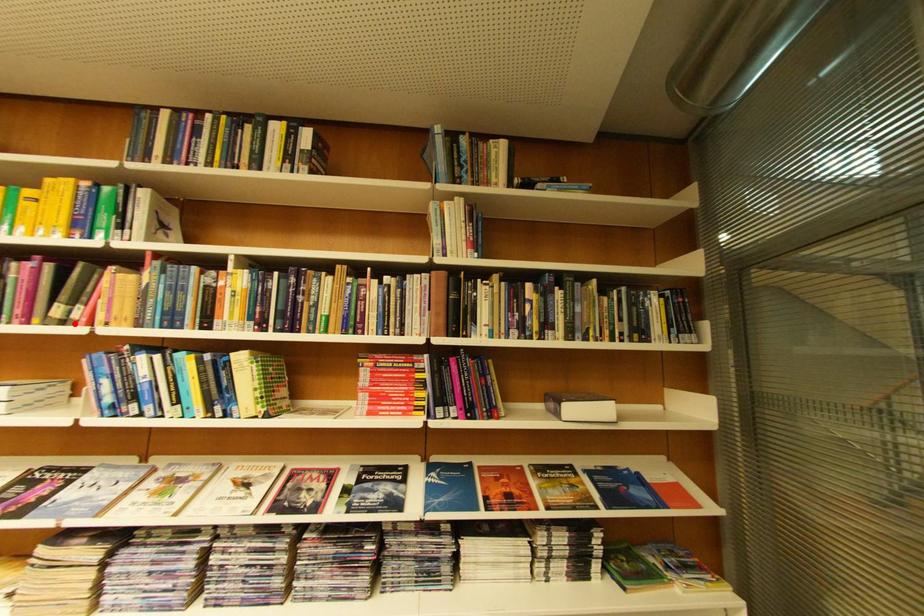
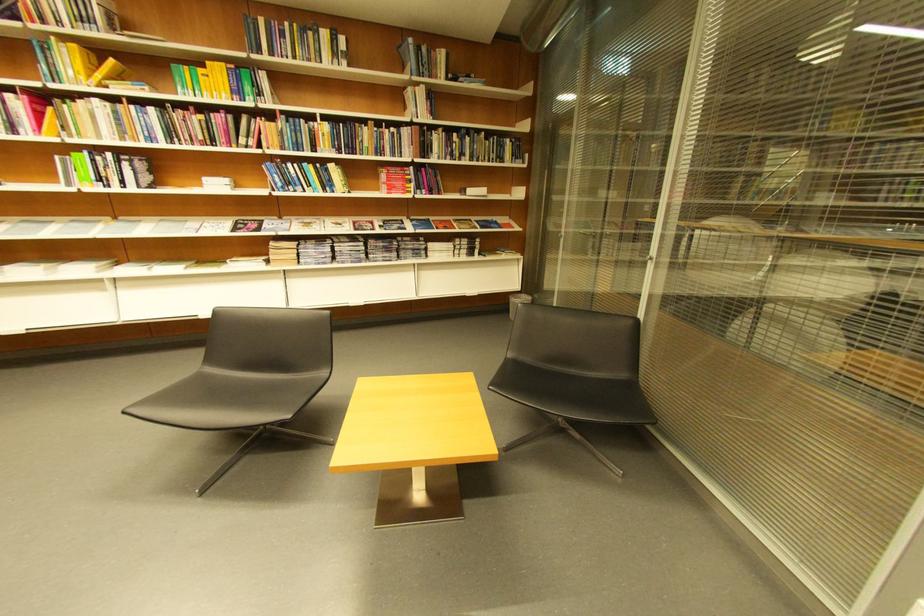
Locate, in the second image, the point that corresponds to the highlighted location in the first image.

(258, 148)